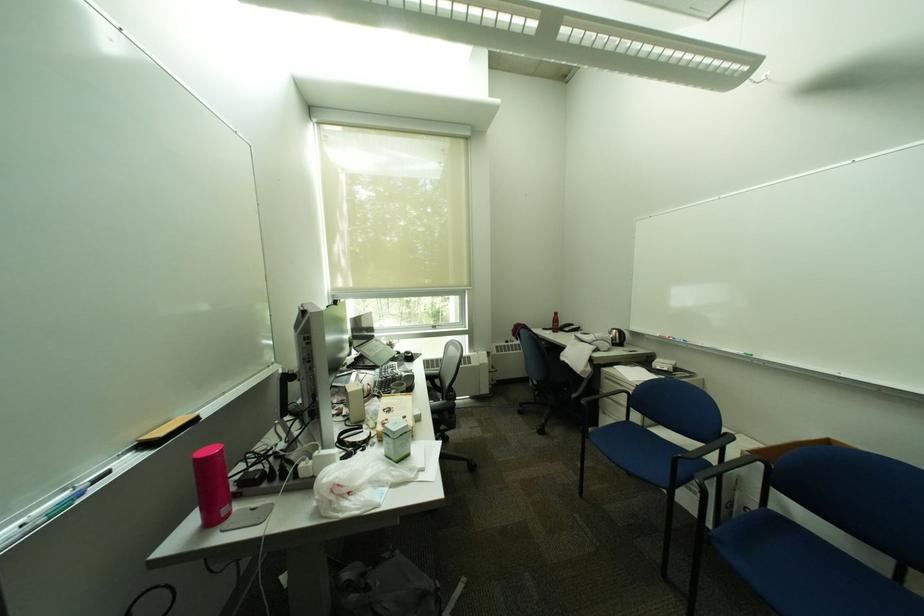
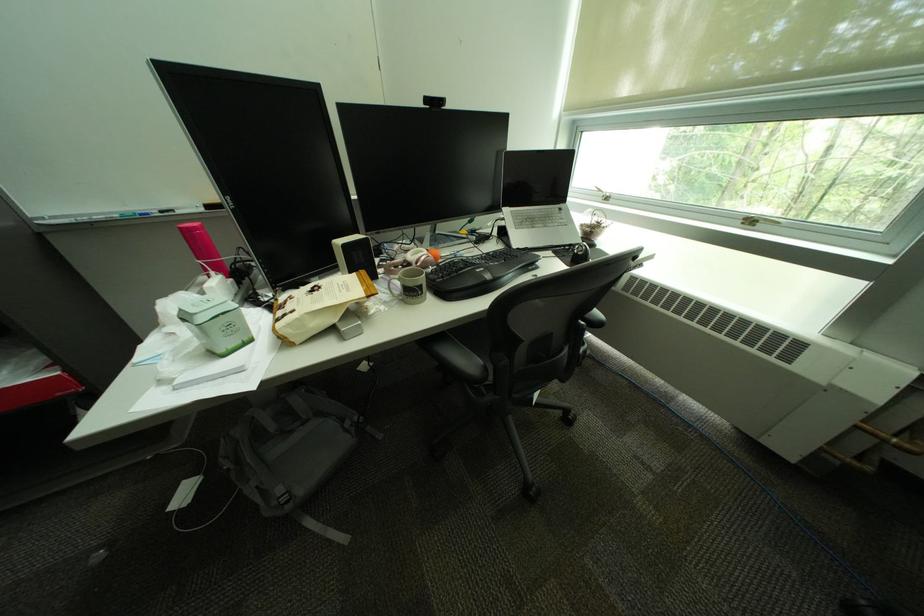
Find the pixel in the second image that matches point 406,357 in the first image.

(580, 246)